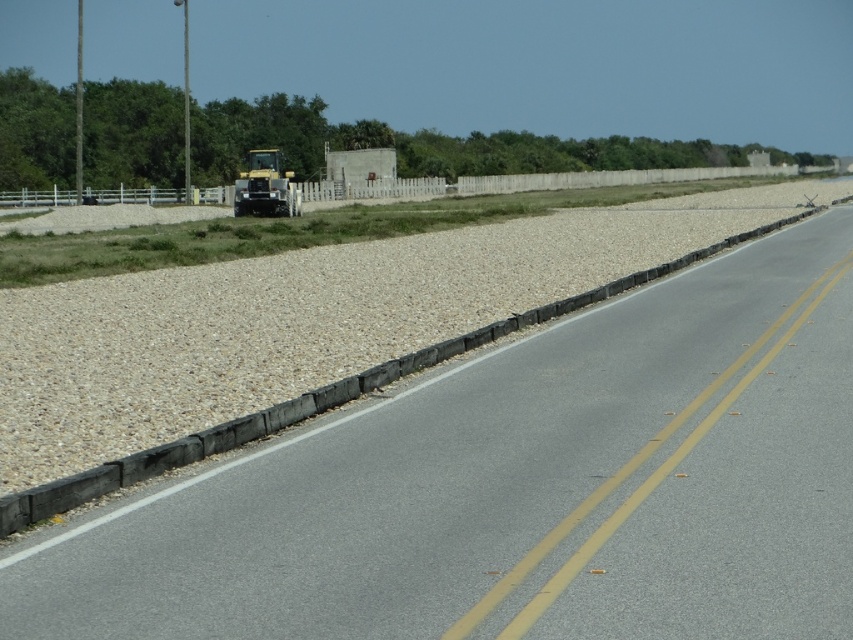
Who is positioned more to the left, asphalt road at center or yellow metallic tractor at center?

From the viewer's perspective, yellow metallic tractor at center appears more on the left side.

Can you confirm if asphalt road at center is bigger than yellow metallic tractor at center?

Actually, asphalt road at center might be smaller than yellow metallic tractor at center.

Between point (838, 433) and point (281, 195), which one is positioned in front?

Positioned in front is point (838, 433).

Where is `asphalt road at center`? asphalt road at center is located at coordinates (521, 488).